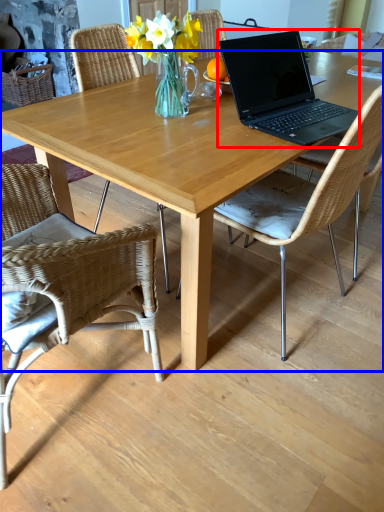
Question: Among these objects, which one is nearest to the camera, laptop (highlighted by a red box) or desk (highlighted by a blue box)?

Choices:
 (A) laptop
 (B) desk

Answer: (B)